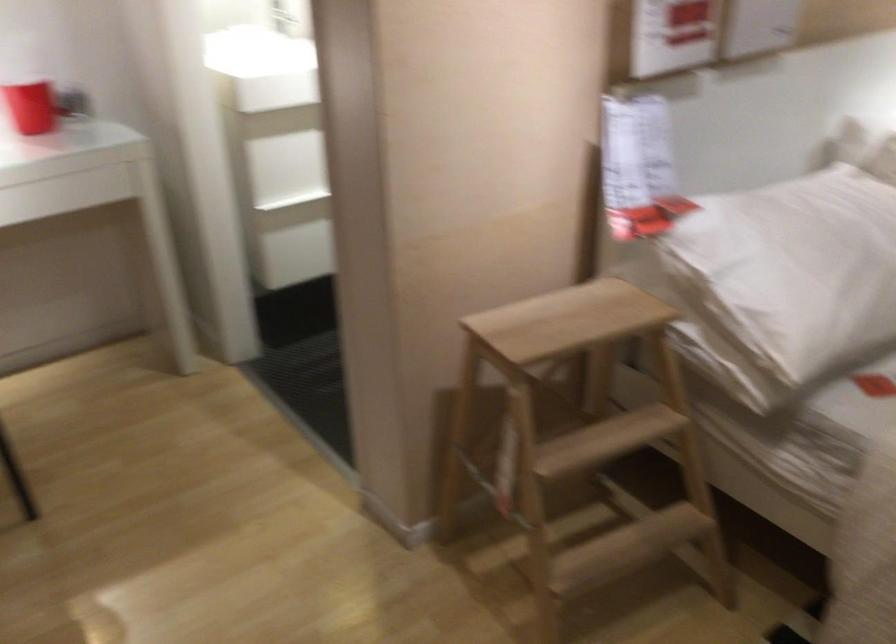
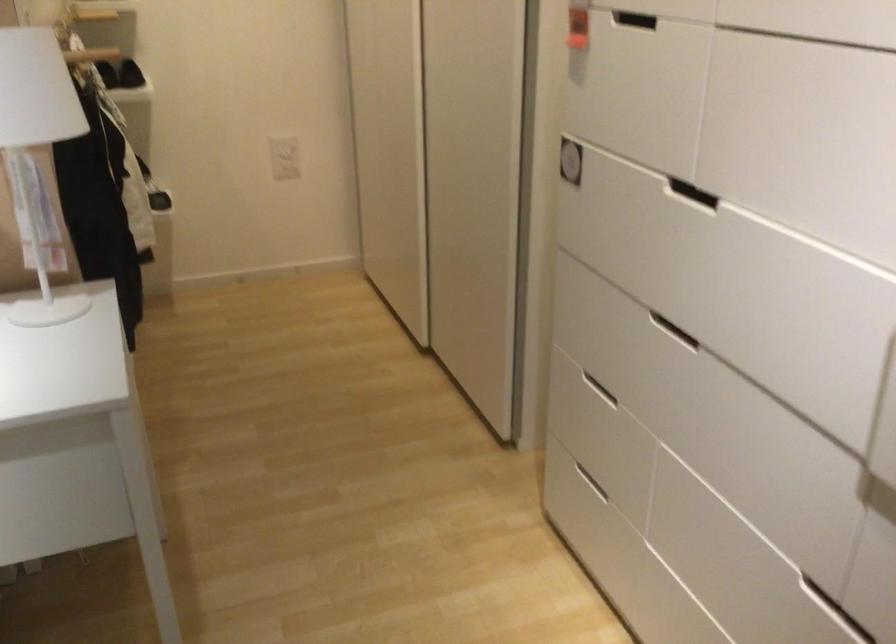
Question: Which direction would the cameraman need to move to produce the second image? Reply with the corresponding letter.

Choices:
 (A) Left
 (B) Right
 (C) Forward
 (D) Backward

Answer: (B)